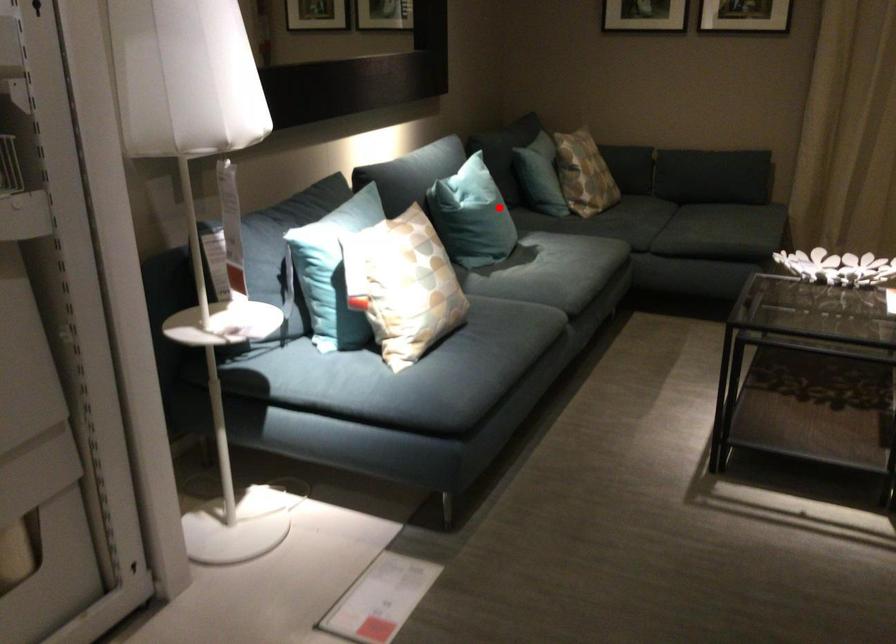
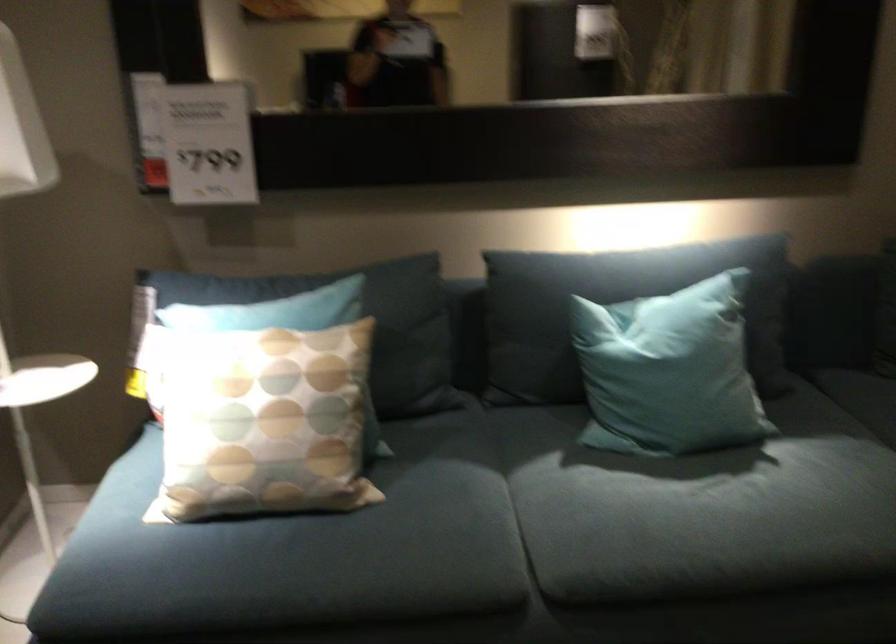
Question: A red point is marked in image1. In image2, is the corresponding 3D point closer to the camera or farther? Reply with the corresponding letter.

Choices:
 (A) The corresponding 3D point is closer.
 (B) The corresponding 3D point is farther.

Answer: (A)